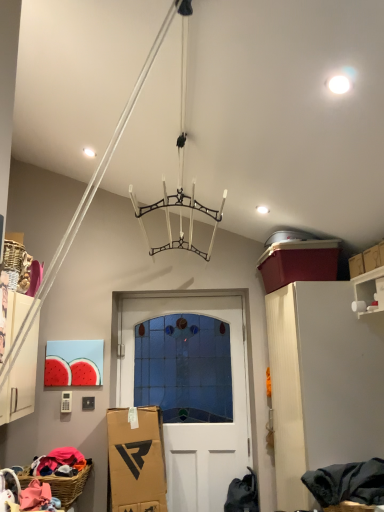
Question: Does white matte cabinet at right have a lesser height compared to woven brown basket at lower left?

Choices:
 (A) no
 (B) yes

Answer: (A)

Question: Is white matte cabinet at right oriented towards woven brown basket at lower left?

Choices:
 (A) no
 (B) yes

Answer: (B)

Question: Can you confirm if white matte cabinet at right is thinner than woven brown basket at lower left?

Choices:
 (A) no
 (B) yes

Answer: (A)

Question: Is white matte cabinet at right at the left side of woven brown basket at lower left?

Choices:
 (A) no
 (B) yes

Answer: (A)

Question: Is white matte cabinet at right completely or partially outside of woven brown basket at lower left?

Choices:
 (A) yes
 (B) no

Answer: (A)

Question: Is point (365, 285) positioned closer to the camera than point (225, 335)?

Choices:
 (A) closer
 (B) farther

Answer: (A)

Question: From the image's perspective, is white glossy shelf at upper right above or below white glass door at center?

Choices:
 (A) above
 (B) below

Answer: (A)

Question: Considering the positions of white glossy shelf at upper right and white glass door at center in the image, is white glossy shelf at upper right bigger or smaller than white glass door at center?

Choices:
 (A) big
 (B) small

Answer: (B)

Question: From a real-world perspective, is white glossy shelf at upper right physically located above or below white glass door at center?

Choices:
 (A) above
 (B) below

Answer: (A)

Question: Relative to white glossy shelf at upper right, is white glass door at center in front or behind?

Choices:
 (A) front
 (B) behind

Answer: (B)

Question: In terms of size, does white glass door at center appear bigger or smaller than white glossy shelf at upper right?

Choices:
 (A) small
 (B) big

Answer: (B)

Question: From a real-world perspective, relative to white glossy shelf at upper right, is white glass door at center vertically above or below?

Choices:
 (A) above
 (B) below

Answer: (B)

Question: In terms of height, does white glass door at center look taller or shorter compared to white glossy shelf at upper right?

Choices:
 (A) short
 (B) tall

Answer: (B)

Question: In terms of width, does white glossy shelf at upper right look wider or thinner when compared to white matte cabinet at right?

Choices:
 (A) thin
 (B) wide

Answer: (A)

Question: From the image's perspective, is white glossy shelf at upper right positioned above or below white matte cabinet at right?

Choices:
 (A) below
 (B) above

Answer: (B)